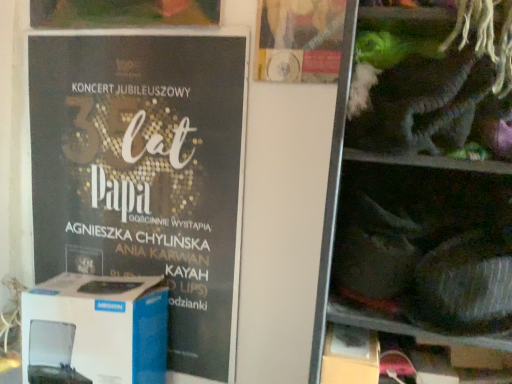
Question: Is matte black poster at left oriented away from white cardboard box at left?

Choices:
 (A) no
 (B) yes

Answer: (B)

Question: Is matte black poster at left thinner than white cardboard box at left?

Choices:
 (A) no
 (B) yes

Answer: (B)

Question: From the image's perspective, does matte black poster at left appear lower than white cardboard box at left?

Choices:
 (A) no
 (B) yes

Answer: (A)

Question: Is matte black poster at left not near white cardboard box at left?

Choices:
 (A) no
 (B) yes

Answer: (A)

Question: Is the depth of matte black poster at left greater than that of white cardboard box at left?

Choices:
 (A) no
 (B) yes

Answer: (B)

Question: In terms of size, does shiny plastic toys at right appear bigger or smaller than white cardboard box at left?

Choices:
 (A) small
 (B) big

Answer: (B)

Question: From their relative heights in the image, would you say shiny plastic toys at right is taller or shorter than white cardboard box at left?

Choices:
 (A) tall
 (B) short

Answer: (A)

Question: Looking at their shapes, would you say shiny plastic toys at right is wider or thinner than white cardboard box at left?

Choices:
 (A) wide
 (B) thin

Answer: (A)

Question: From a real-world perspective, is shiny plastic toys at right physically located above or below white cardboard box at left?

Choices:
 (A) below
 (B) above

Answer: (B)

Question: Considering their positions, is matte gold poster at upper center located in front of or behind matte black poster at left?

Choices:
 (A) front
 (B) behind

Answer: (A)

Question: From a real-world perspective, relative to matte black poster at left, is matte gold poster at upper center vertically above or below?

Choices:
 (A) above
 (B) below

Answer: (A)

Question: In the image, is matte gold poster at upper center on the left side or the right side of matte black poster at left?

Choices:
 (A) right
 (B) left

Answer: (A)

Question: Considering the positions of matte gold poster at upper center and matte black poster at left in the image, is matte gold poster at upper center taller or shorter than matte black poster at left?

Choices:
 (A) short
 (B) tall

Answer: (A)

Question: Is point (161, 324) positioned closer to the camera than point (446, 81)?

Choices:
 (A) farther
 (B) closer

Answer: (A)

Question: From a real-world perspective, relative to shiny plastic toys at right, is white cardboard box at left vertically above or below?

Choices:
 (A) below
 (B) above

Answer: (A)